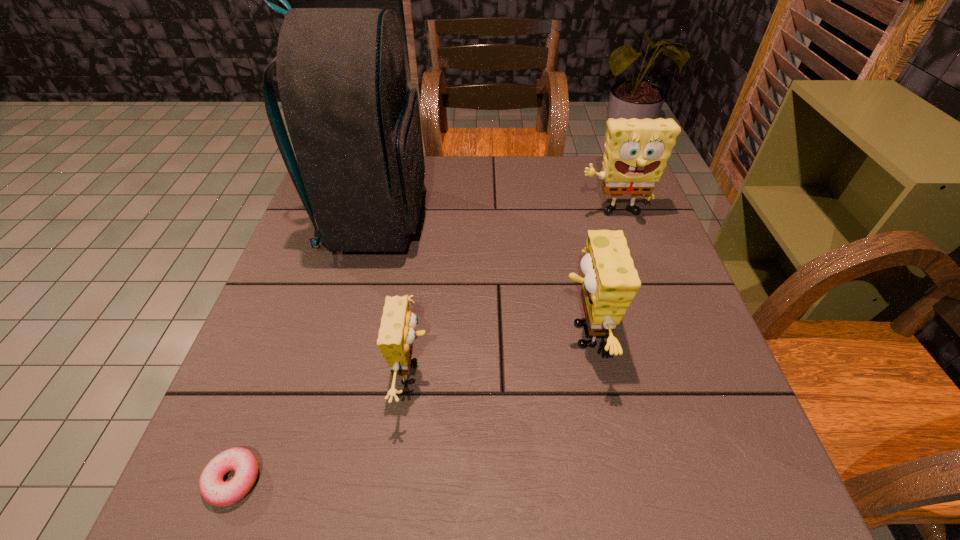
Identify the location of backpack. (354, 124).

At what (x,y) coordinates should I click in order to perform the action: click on the farthest sponge. Please return your answer as a coordinate pair (x, y). Image resolution: width=960 pixels, height=540 pixels. Looking at the image, I should click on (636, 150).

Find the location of a particular element. The image size is (960, 540). the fourth tallest object is located at coordinates (396, 335).

This screenshot has height=540, width=960. What are the coordinates of `the leftmost sponge` in the screenshot? It's located at (396, 335).

Image resolution: width=960 pixels, height=540 pixels. I want to click on the shortest object, so click(214, 490).

Image resolution: width=960 pixels, height=540 pixels. Find the location of `doughnut`. doughnut is located at coordinates (214, 490).

You are a GUI agent. You are given a task and a screenshot of the screen. Output one action in this format:
    pyautogui.click(x=<x>, y=<y>)
    Task: Click on the blank space located 0.220m on the front-facing side of the backpack
    This screenshot has height=540, width=960.
    Given the screenshot: What is the action you would take?
    pyautogui.click(x=513, y=221)

The image size is (960, 540). I want to click on free space located on the face of the farthest sponge, so click(x=657, y=342).

Identify the location of free space located 0.270m on the face of the leftmost sponge. (575, 372).

Locate an element on the screen. The width and height of the screenshot is (960, 540). vacant region located on the right of the doughnut is located at coordinates (375, 480).